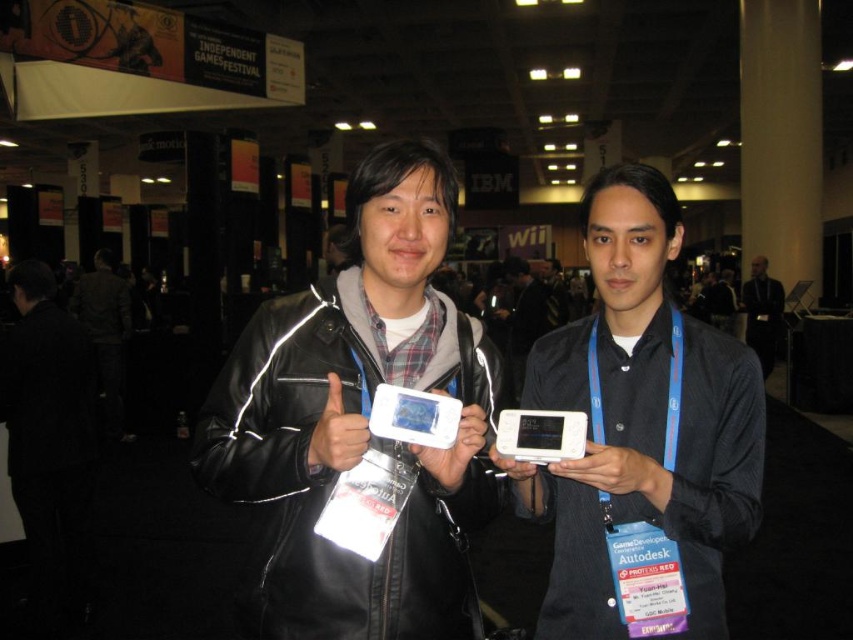
Question: Estimate the real-world distances between objects in this image. Which object is farther from the black leather jacket at center?

Choices:
 (A) matte black phone at center
 (B) white matte phone at center

Answer: (A)

Question: Which point is farther from the camera taking this photo?

Choices:
 (A) (100, 388)
 (B) (751, 300)
 (C) (598, 182)
 (D) (544, 289)

Answer: (B)

Question: Does black leather jacket at left appear over matte black phone at center?

Choices:
 (A) yes
 (B) no

Answer: (B)

Question: Is black leather jacket at center below black leather jacket at left?

Choices:
 (A) no
 (B) yes

Answer: (A)

Question: Considering the relative positions of white matte phone at center and dark gray shirt at center in the image provided, where is white matte phone at center located with respect to dark gray shirt at center?

Choices:
 (A) above
 (B) below

Answer: (B)

Question: Based on their relative distances, which object is nearer to the dark gray shirt at center?

Choices:
 (A) black leather jacket at left
 (B) black leather jacket at center
 (C) white matte phone at center
 (D) matte black phone at center

Answer: (D)